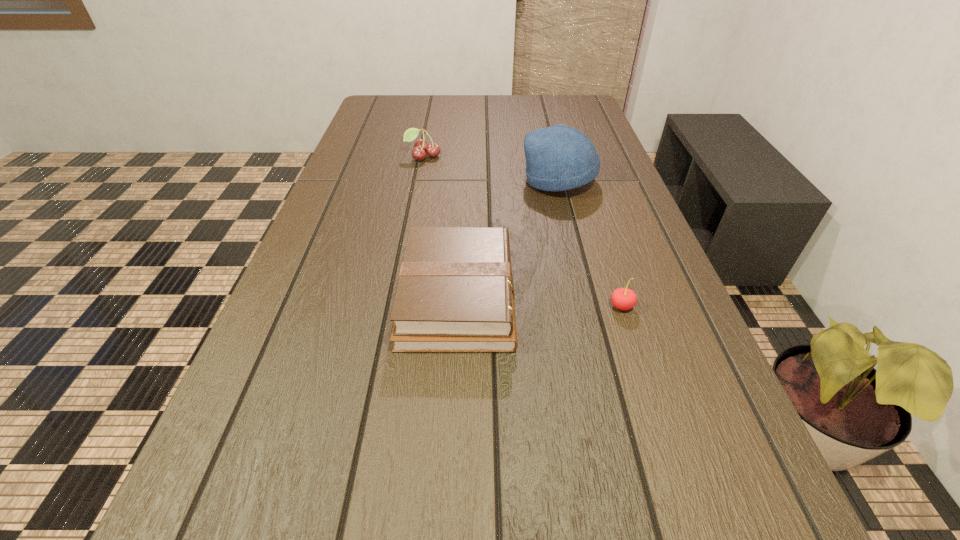
This screenshot has width=960, height=540. In the image, there is a desktop. Identify the location of vacant space at the far edge. tap(419, 112).

In the image, there is a desktop. Where is `free region at the left edge`? This screenshot has width=960, height=540. free region at the left edge is located at coordinates (382, 160).

In the image, there is a desktop. Where is `vacant area at the right edge`? vacant area at the right edge is located at coordinates (597, 193).

Where is `empty location between the Bible and the left cherry`? empty location between the Bible and the left cherry is located at coordinates (441, 227).

The width and height of the screenshot is (960, 540). What are the coordinates of `free space that is in between the skullcap and the left cherry` in the screenshot? It's located at (492, 168).

Find the location of a particular element. The width and height of the screenshot is (960, 540). vacant area between the left cherry and the tallest object is located at coordinates (492, 168).

Locate an element on the screen. free space between the right cherry and the left cherry is located at coordinates (522, 231).

Where is `empty space between the nearer cherry and the tallest object`? The height and width of the screenshot is (540, 960). empty space between the nearer cherry and the tallest object is located at coordinates (590, 244).

Locate an element on the screen. The width and height of the screenshot is (960, 540). empty space that is in between the right cherry and the tallest object is located at coordinates (590, 244).

The height and width of the screenshot is (540, 960). I want to click on free space between the right cherry and the left cherry, so click(x=522, y=231).